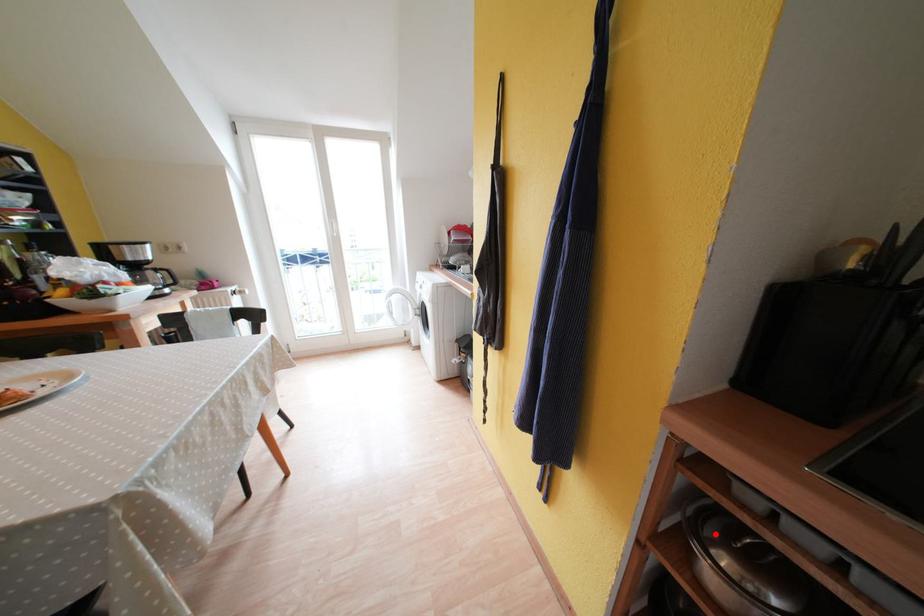
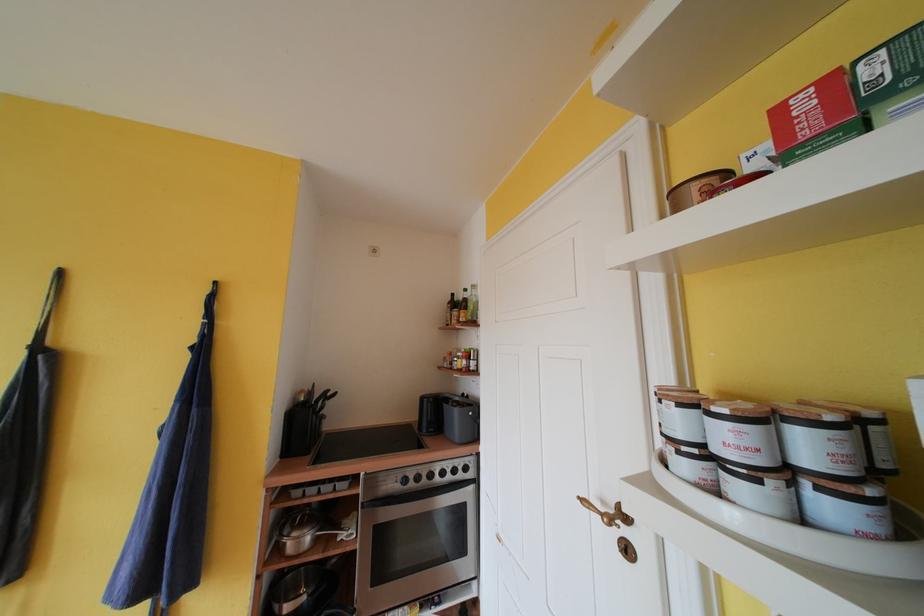
Question: I am providing you with two images of the same scene from different viewpoints. A red point is marked on the first image. Can you still see the location of the red point in image 2?

Choices:
 (A) Yes
 (B) No

Answer: (A)